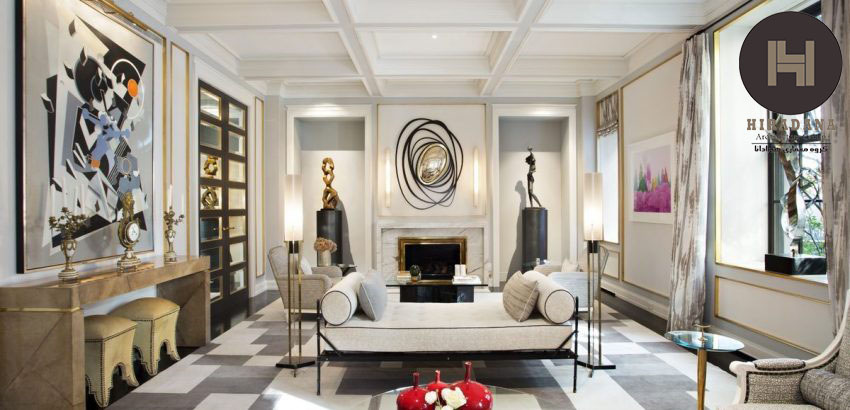
Image resolution: width=850 pixels, height=410 pixels. I want to click on places to sit, so click(x=442, y=312), click(x=309, y=274), click(x=570, y=270), click(x=148, y=320), click(x=111, y=338), click(x=795, y=403).